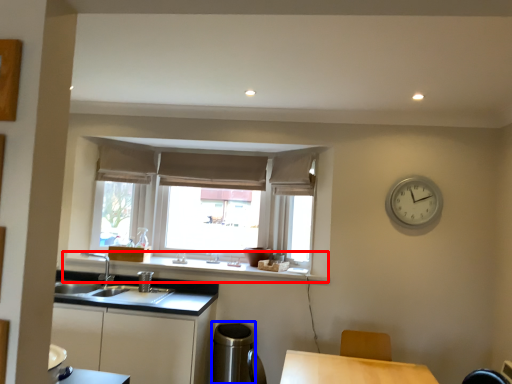
Question: Which point is further to the camera, window sill (highlighted by a red box) or appliance (highlighted by a blue box)?

Choices:
 (A) window sill
 (B) appliance

Answer: (A)